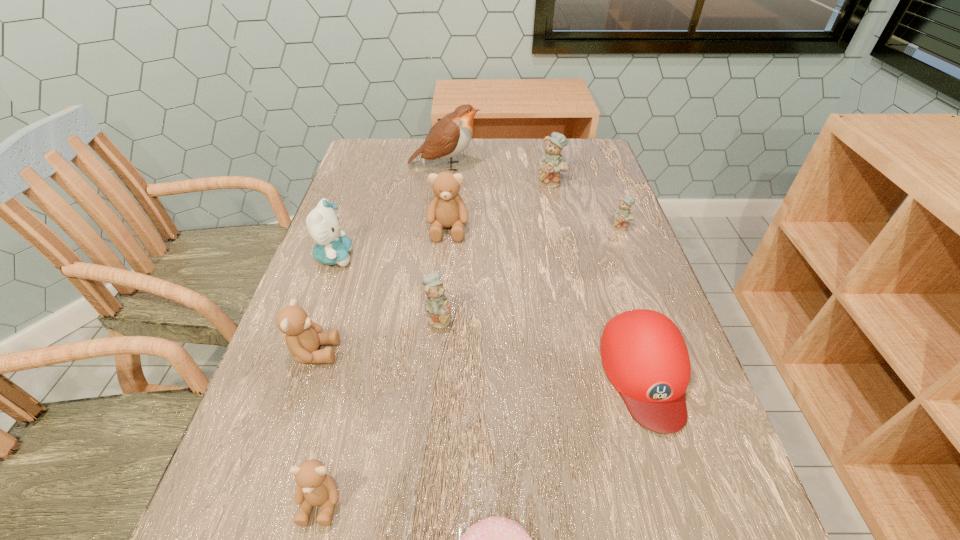
The image size is (960, 540). I want to click on object that stands as the seventh closest to the leftmost blue teddy bear, so click(623, 214).

In order to click on the third closest teddy bear to the biggest brown teddy bear in this screenshot , I will do `click(303, 337)`.

Identify which teddy bear is located as the third nearest to the rightmost brown teddy bear. Please provide its 2D coordinates. Your answer should be formatted as a tuple, i.e. [(x, y)], where the tuple contains the x and y coordinates of a point satisfying the conditions above.

[(303, 337)]

Point out which blue teddy bear is positioned as the second nearest to the doughnut. Please provide its 2D coordinates. Your answer should be formatted as a tuple, i.e. [(x, y)], where the tuple contains the x and y coordinates of a point satisfying the conditions above.

[(623, 214)]

Identify which blue teddy bear is the nearest to the second smallest blue teddy bear. Please provide its 2D coordinates. Your answer should be formatted as a tuple, i.e. [(x, y)], where the tuple contains the x and y coordinates of a point satisfying the conditions above.

[(623, 214)]

At what (x,y) coordinates should I click in order to perform the action: click on the second closest brown teddy bear relative to the second teddy bear from left to right. Please return your answer as a coordinate pair (x, y). The height and width of the screenshot is (540, 960). Looking at the image, I should click on (447, 209).

The height and width of the screenshot is (540, 960). I want to click on brown teddy bear that stands as the closest to the smallest blue teddy bear, so click(447, 209).

The height and width of the screenshot is (540, 960). I want to click on vacant space that satisfies the following two spatial constraints: 1. on the front-facing side of the rightmost teddy bear; 2. on the front-facing side of the second smallest brown teddy bear, so click(667, 352).